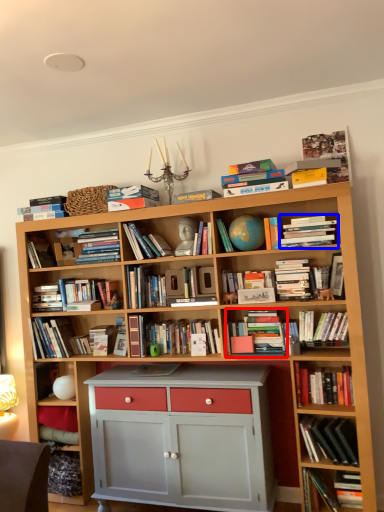
Question: Which of the following is the closest to the observer, book (highlighted by a red box) or book (highlighted by a blue box)?

Choices:
 (A) book
 (B) book

Answer: (B)